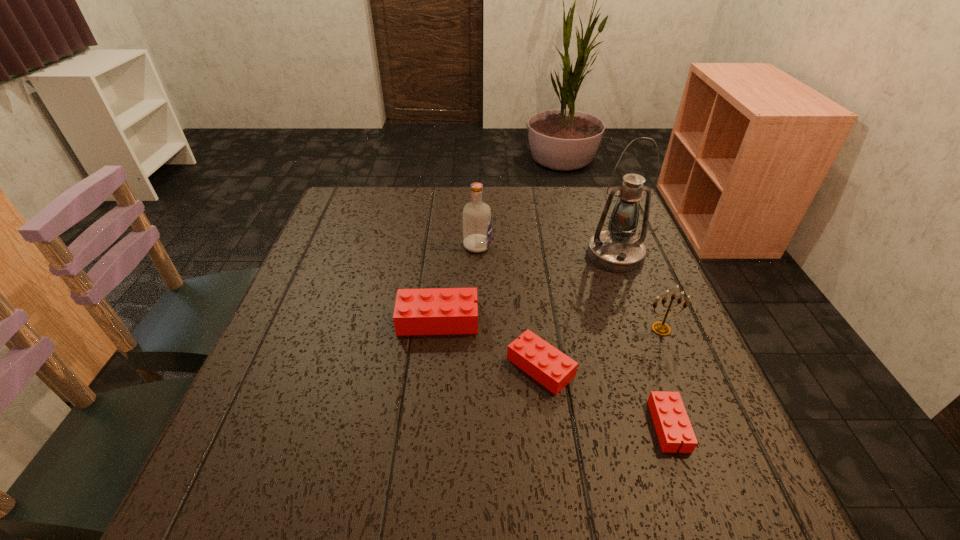
Please point a spot on the left to add another Lego. Please provide its 2D coordinates. Your answer should be formatted as a tuple, i.e. [(x, y)], where the tuple contains the x and y coordinates of a point satisfying the conditions above.

[(354, 281)]